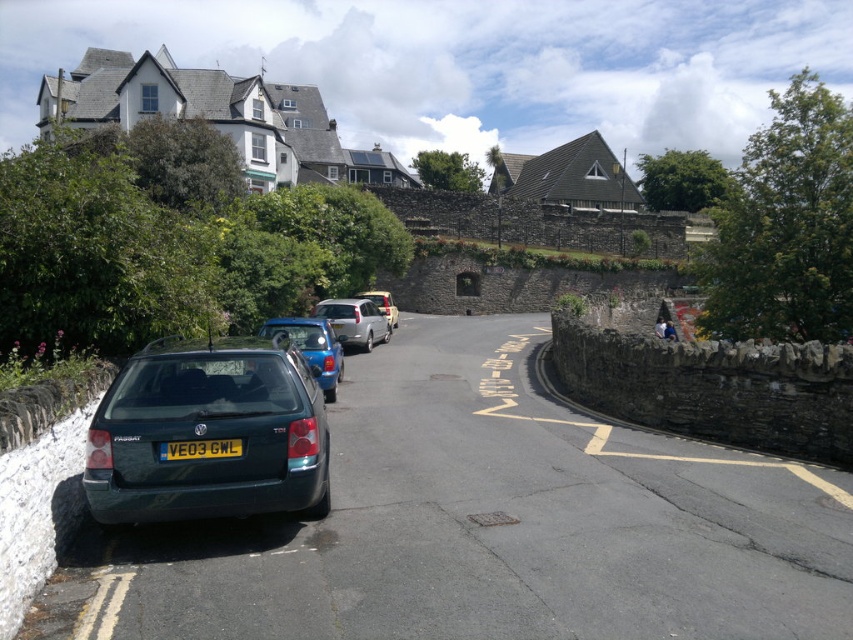
Image resolution: width=853 pixels, height=640 pixels. What do you see at coordinates (209, 433) in the screenshot?
I see `metallic green estate car at lower left` at bounding box center [209, 433].

Is metallic green estate car at lower left bigger than blue metallic hatchback at center?

No, metallic green estate car at lower left is not bigger than blue metallic hatchback at center.

Who is more forward, (201, 426) or (322, 385)?

Point (201, 426) is in front.

Locate an element on the screen. The image size is (853, 640). metallic green estate car at lower left is located at coordinates (209, 433).

Which of these two, satin silver van at center or silver metallic van at center, stands shorter?

With less height is satin silver van at center.

Locate an element on the screen. The width and height of the screenshot is (853, 640). satin silver van at center is located at coordinates (354, 321).

Based on the photo, is metallic green estate car at lower left wider than yellow matte license plate at center?

Indeed, metallic green estate car at lower left has a greater width compared to yellow matte license plate at center.

Is metallic green estate car at lower left behind yellow matte license plate at center?

No, it is not.

Who is more distant from viewer, (x=144, y=481) or (x=183, y=448)?

The point (x=183, y=448) is behind.

At what (x,y) coordinates should I click in order to perform the action: click on metallic green estate car at lower left. Please return your answer as a coordinate pair (x, y). Looking at the image, I should click on (209, 433).